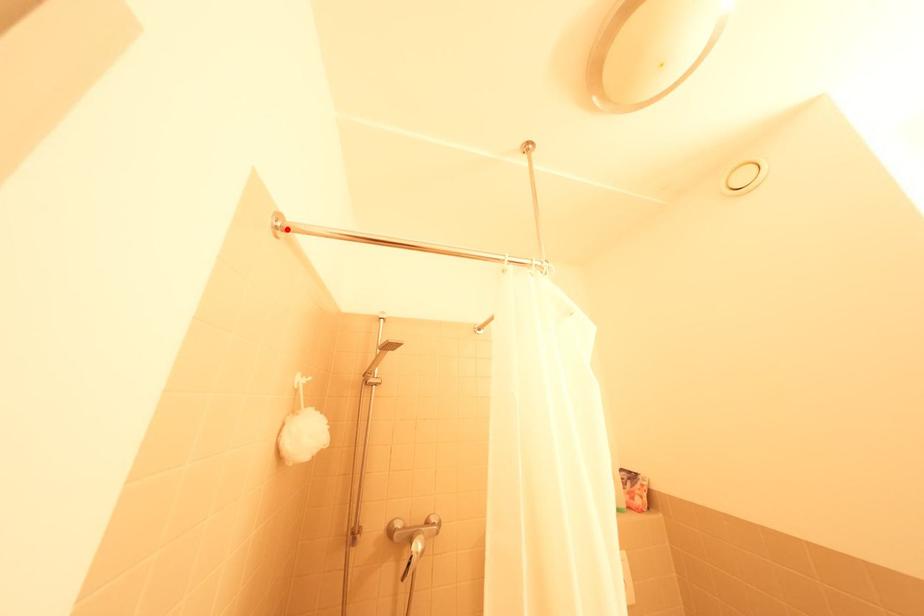
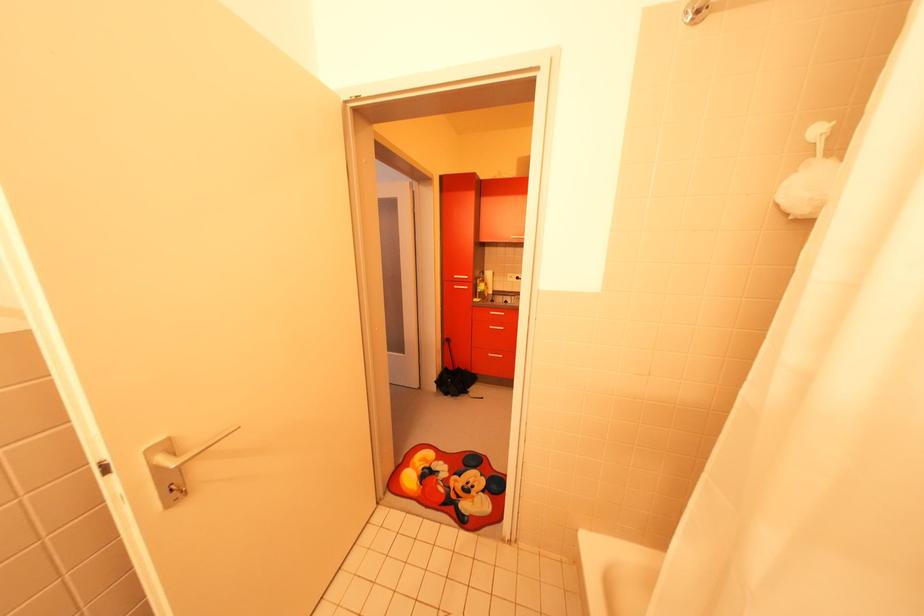
The point at the highlighted location is marked in the first image. Where is the corresponding point in the second image?

(702, 20)